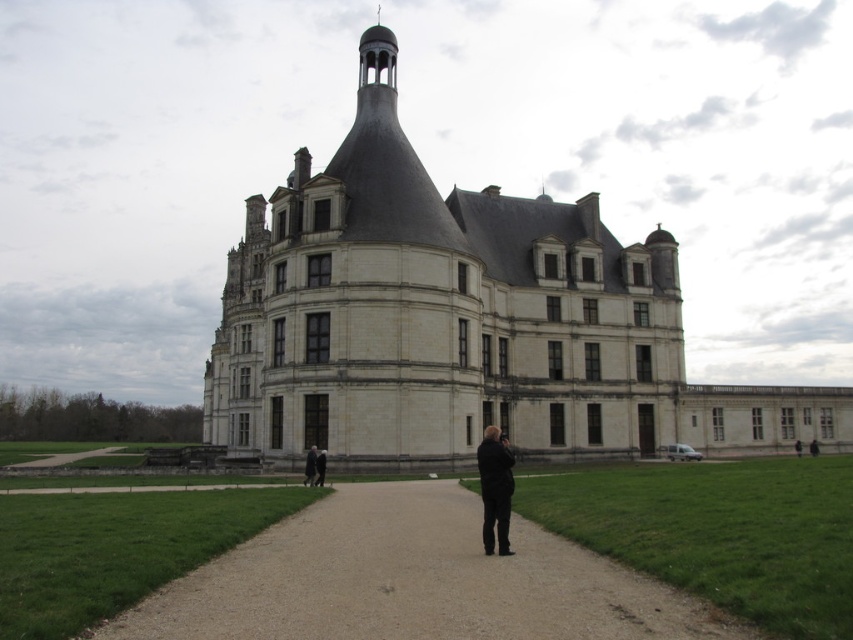
Question: Is white stone castle at center thinner than black leather jacket at lower center?

Choices:
 (A) no
 (B) yes

Answer: (A)

Question: Which object is the farthest from the dark brown leather jacket at lower right?

Choices:
 (A) black leather jacket at lower center
 (B) black leather jacket at lower right
 (C) white stone castle at center
 (D) black fabric at center

Answer: (A)

Question: Estimate the real-world distances between objects in this image. Which object is farther from the black fabric at center?

Choices:
 (A) dark brown leather jacket at lower right
 (B) dirt/gravel path at center

Answer: (A)

Question: Observing the image, what is the correct spatial positioning of black fabric at center in reference to black leather jacket at lower center?

Choices:
 (A) right
 (B) left

Answer: (A)

Question: Is black fabric at center below black leather jacket at lower center?

Choices:
 (A) no
 (B) yes

Answer: (A)

Question: Which point is farther to the camera?

Choices:
 (A) dark brown leather jacket at lower right
 (B) black leather jacket at lower center

Answer: (A)